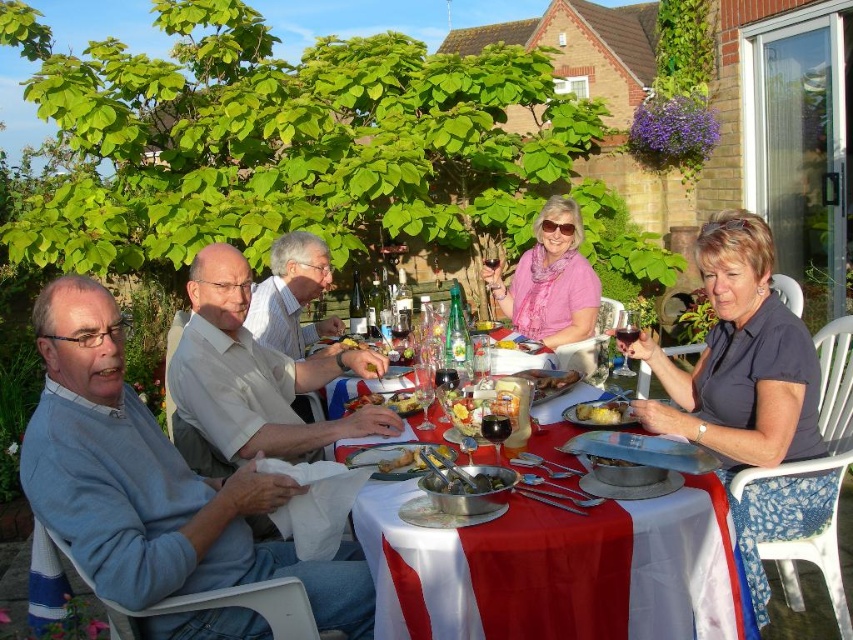
Question: Does dark blue shirt at upper right have a lesser width compared to pink fabric scarf at center?

Choices:
 (A) no
 (B) yes

Answer: (A)

Question: Does white glossy table at center have a smaller size compared to pink fabric scarf at center?

Choices:
 (A) no
 (B) yes

Answer: (B)

Question: Is light blue sweater at left to the left of white glossy table at center from the viewer's perspective?

Choices:
 (A) yes
 (B) no

Answer: (A)

Question: Which point is farther to the camera?

Choices:
 (A) (759, 305)
 (B) (357, 403)
 (C) (578, 420)
 (D) (421, 451)

Answer: (B)

Question: Which object appears farthest from the camera in this image?

Choices:
 (A) shiny silver fork at center
 (B) dark blue shirt at upper right
 (C) pink fabric scarf at center
 (D) golden crispy chicken at center

Answer: (C)

Question: Which of the following is the farthest from the observer?

Choices:
 (A) golden crispy chicken at center
 (B) white glossy table at center

Answer: (A)